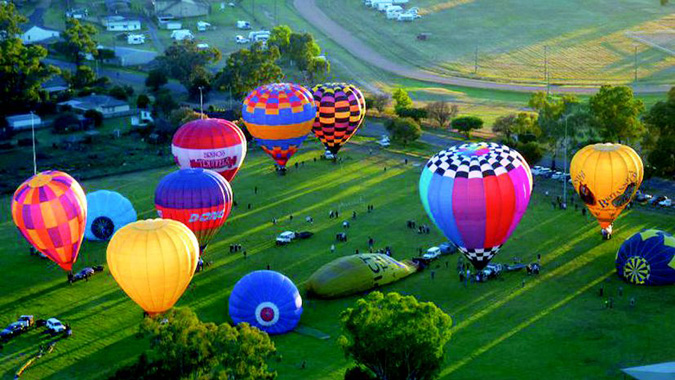
Where is `inflated balloons`? Image resolution: width=675 pixels, height=380 pixels. inflated balloons is located at coordinates (154, 273), (59, 231), (183, 192), (209, 149), (265, 105), (351, 108), (500, 199), (589, 187).